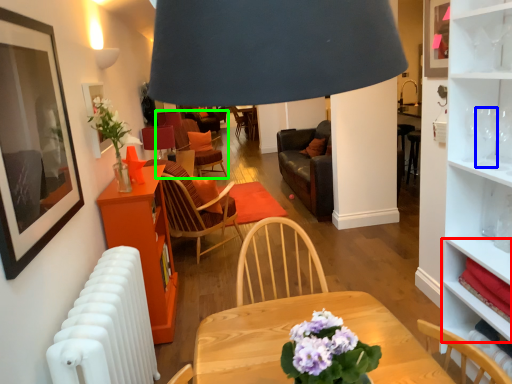
Question: Which object is positioned closest to cabinet (highlighted by a red box)? Select from wine glass (highlighted by a blue box) and chair (highlighted by a green box).

Choices:
 (A) wine glass
 (B) chair

Answer: (A)